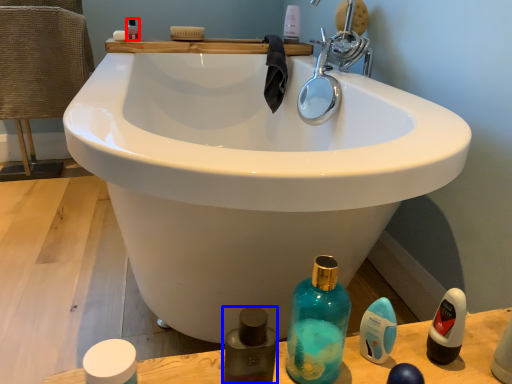
Question: Which object appears farthest to the camera in this image, mouthwash (highlighted by a red box) or cleaning product (highlighted by a blue box)?

Choices:
 (A) mouthwash
 (B) cleaning product

Answer: (A)